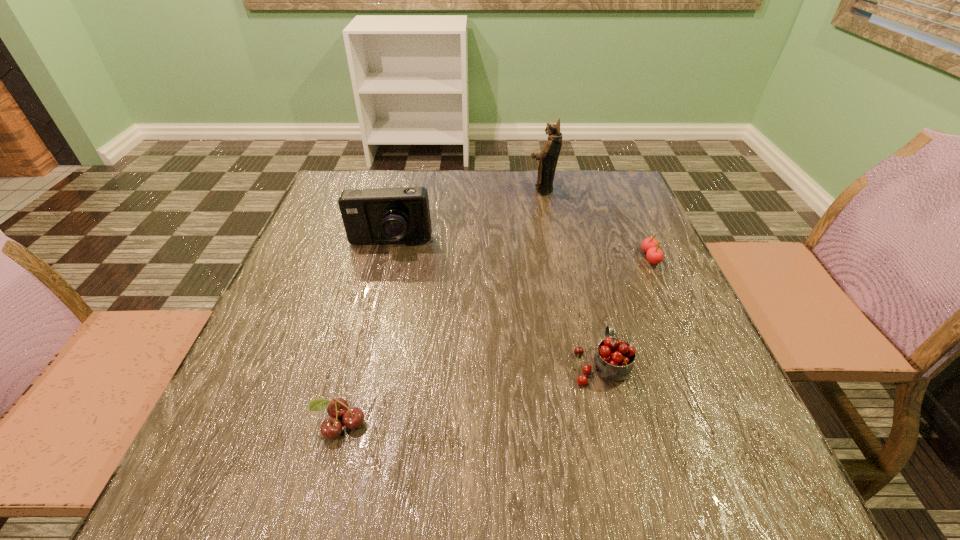
At what (x,y) coordinates should I click in order to perform the action: click on vacant space located on the front-facing side of the farthest object. Please return your answer as a coordinate pair (x, y). The height and width of the screenshot is (540, 960). Looking at the image, I should click on (432, 189).

This screenshot has height=540, width=960. I want to click on vacant area situated on the front-facing side of the farthest object, so click(x=457, y=189).

This screenshot has height=540, width=960. What are the coordinates of `vacant area located 0.070m on the front-facing side of the camera` in the screenshot? It's located at (382, 274).

You are a GUI agent. You are given a task and a screenshot of the screen. Output one action in this format:
    pyautogui.click(x=<x>, y=<y>)
    Task: Click on the blank area located on the handle side of the third tallest object
    Image resolution: width=960 pixels, height=540 pixels.
    Given the screenshot: What is the action you would take?
    pyautogui.click(x=569, y=238)

You are a GUI agent. You are given a task and a screenshot of the screen. Output one action in this format:
    pyautogui.click(x=<x>, y=<y>)
    Task: Click on the vacant space located on the handle side of the third tallest object
    Image resolution: width=960 pixels, height=540 pixels.
    Given the screenshot: What is the action you would take?
    pyautogui.click(x=572, y=251)

This screenshot has height=540, width=960. In order to click on vacant region located on the handle side of the third tallest object in this screenshot , I will do `click(590, 323)`.

Locate an element on the screen. The image size is (960, 540). free space located on the leaves of the nearest cherry is located at coordinates (319, 504).

At what (x,y) coordinates should I click in order to perform the action: click on blank space located 0.210m on the front of the rightmost cherry. Please return your answer as a coordinate pair (x, y). Looking at the image, I should click on (688, 341).

Where is `object at the far edge`? The image size is (960, 540). object at the far edge is located at coordinates (548, 157).

Locate an element on the screen. object that is at the left edge is located at coordinates (383, 215).